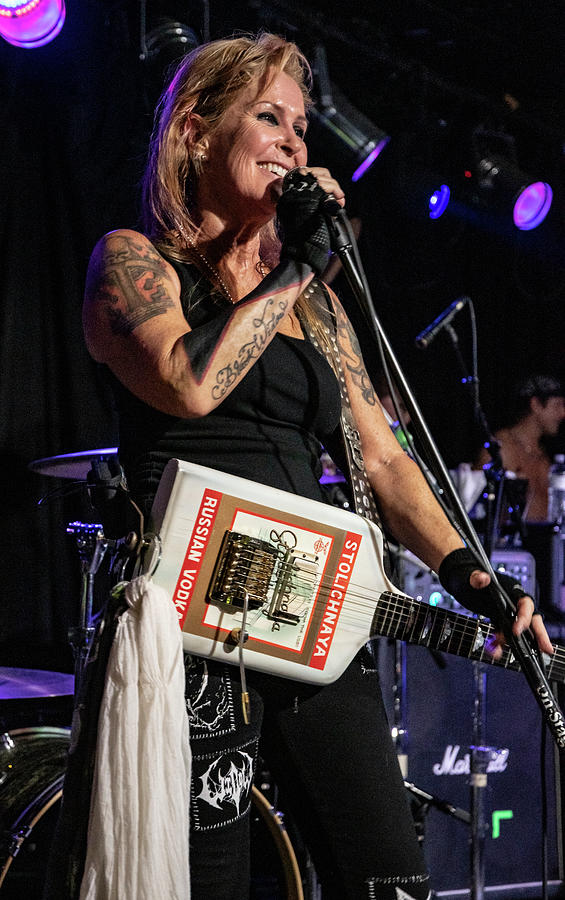
Find the location of a particular element. amplifirer is located at coordinates (453, 686).